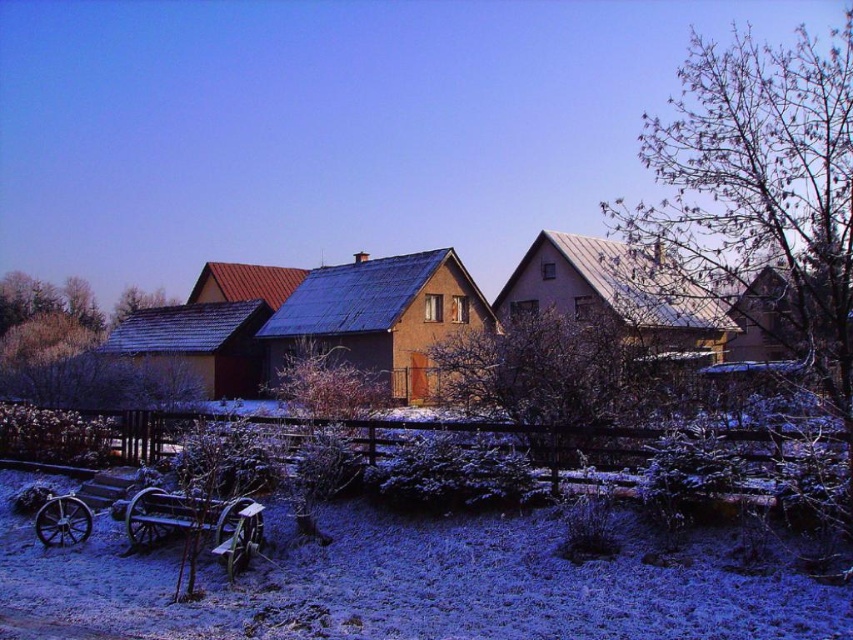
You are a photographer planning to capture both the brown textured house at center and the wooden wagon at lower left in a single frame. Considering their sizes, which object should you position closer to the camera to ensure both are visible in the frame without cropping?

Since the brown textured house at center is much taller than the wooden wagon at lower left, positioning the wooden wagon at lower left closer to the camera would help balance their sizes in the frame, ensuring both are fully visible without cropping.

You are standing at the center of the image and want to walk towards the matte brown hut at left. In which direction should you head?

Since the matte brown hut at left is located at point 0.537 on the x axis and 0.232 on the y axis, you should head towards the left and slightly upwards to reach it.

Looking at the winter scene, which object has a narrower width between the bare branches at center and the green leafy tree at upper left?

The bare branches at center has a narrower width compared to the green leafy tree at upper left.